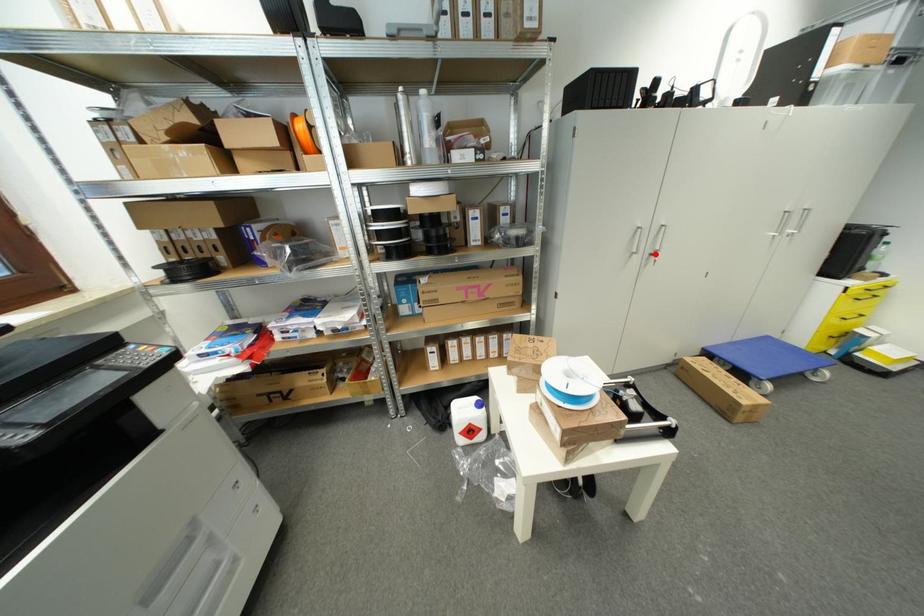
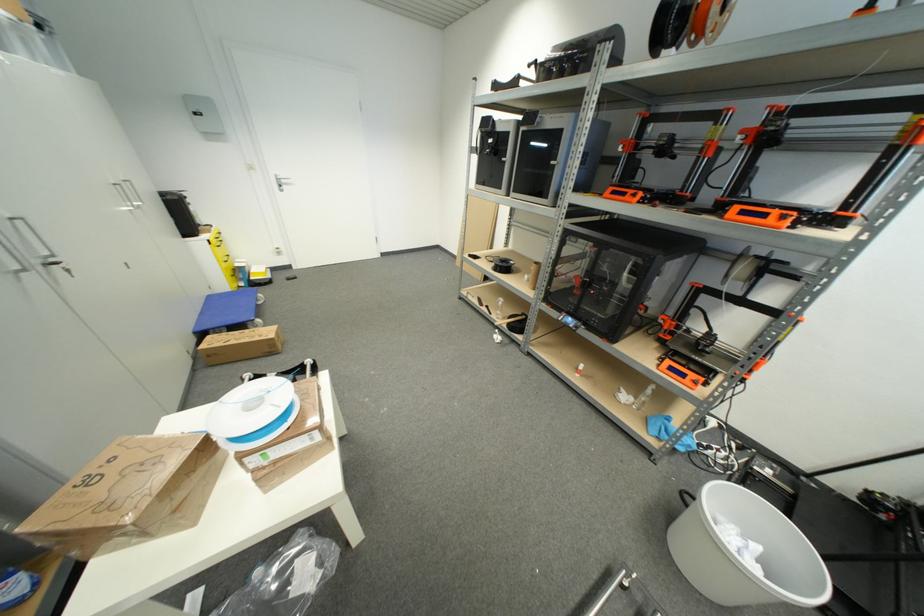
The point at the highlighted location is marked in the first image. Where is the corresponding point in the second image?

(43, 264)